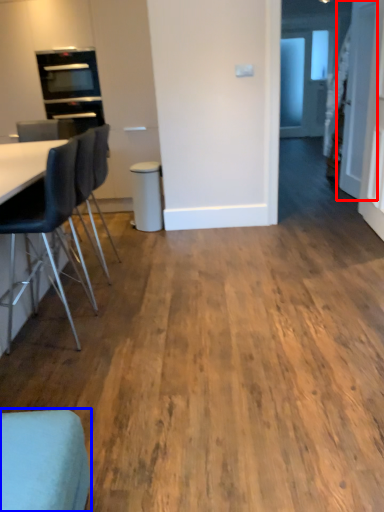
Question: Which point is further to the camera, door (highlighted by a red box) or chair (highlighted by a blue box)?

Choices:
 (A) door
 (B) chair

Answer: (A)